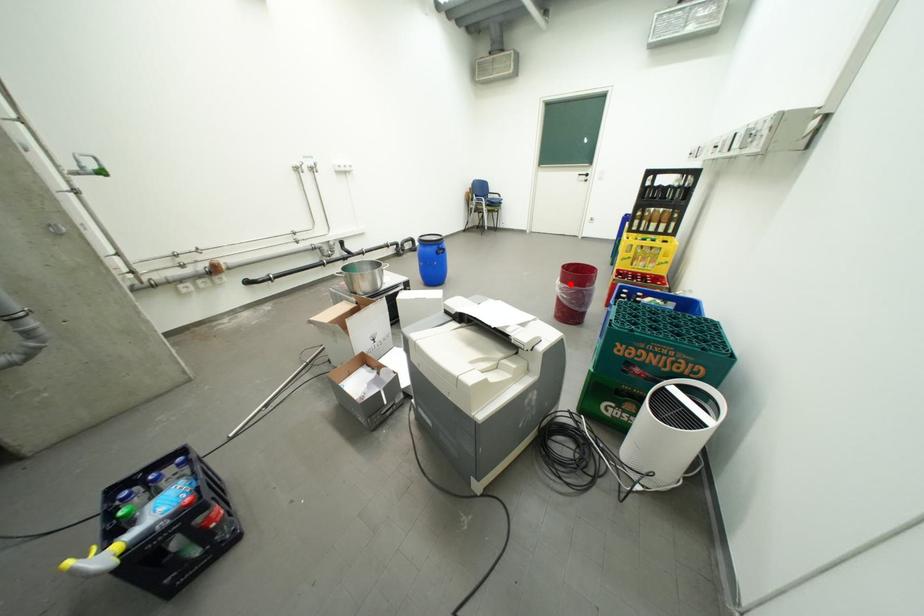
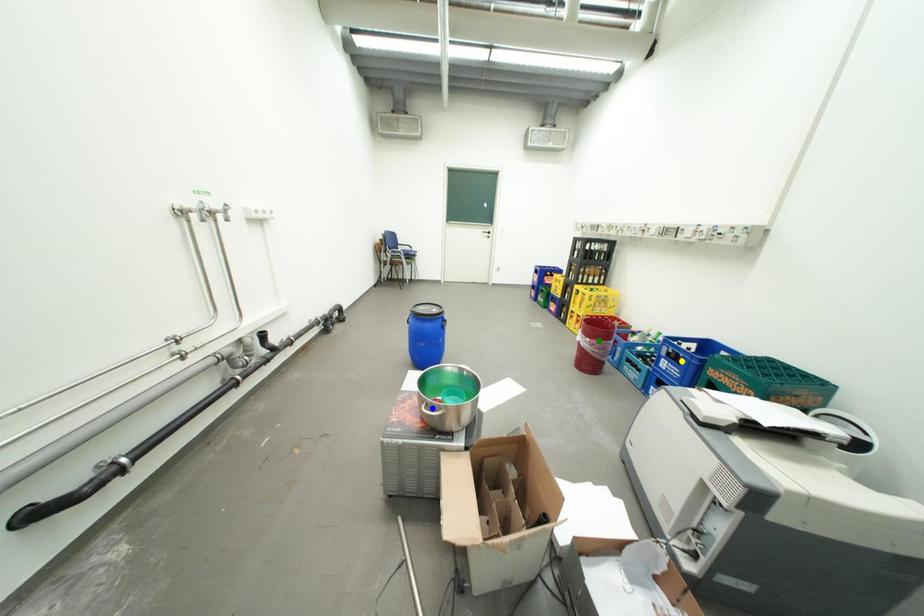
Question: I am providing you with two images of the same scene from different viewpoints. A red point is marked on the first image. You are given multiple points on the second image. Which point in image 2 is actually the same real-world point as the red point in image 1?

Choices:
 (A) blue point
 (B) green point
 (C) yellow point

Answer: (B)